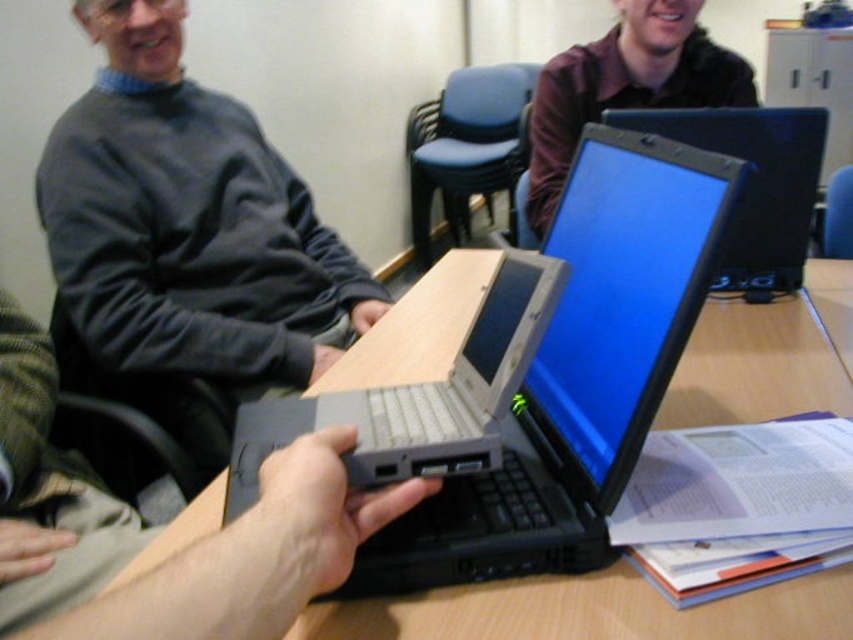
Who is taller, dark gray sweater at upper left or black glossy laptop at center?

With more height is dark gray sweater at upper left.

Does dark gray sweater at upper left have a greater width compared to black glossy laptop at center?

Correct, the width of dark gray sweater at upper left exceeds that of black glossy laptop at center.

I want to click on dark gray sweater at upper left, so click(184, 241).

I want to click on dark gray sweater at upper left, so click(x=184, y=241).

Can you confirm if wooden table at center is shorter than black glossy laptop at center?

Indeed, wooden table at center has a lesser height compared to black glossy laptop at center.

Who is lower down, wooden table at center or black glossy laptop at center?

wooden table at center is lower down.

Between point (708, 342) and point (776, 237), which one is positioned in front?

Point (708, 342) is in front.

Where is `wooden table at center`? wooden table at center is located at coordinates (589, 612).

Is point (151, 72) positioned in front of point (590, 93)?

Yes, it is.

Find the location of a particular element. dark gray sweater at upper left is located at coordinates (184, 241).

Does point (242, 307) come behind point (558, 193)?

That is False.

This screenshot has height=640, width=853. In order to click on dark gray sweater at upper left in this screenshot , I will do `click(184, 241)`.